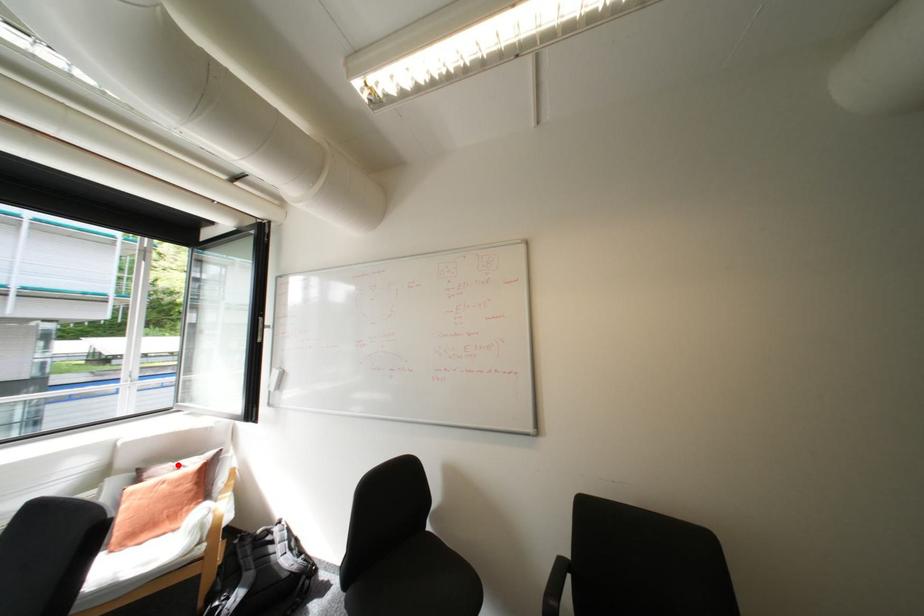
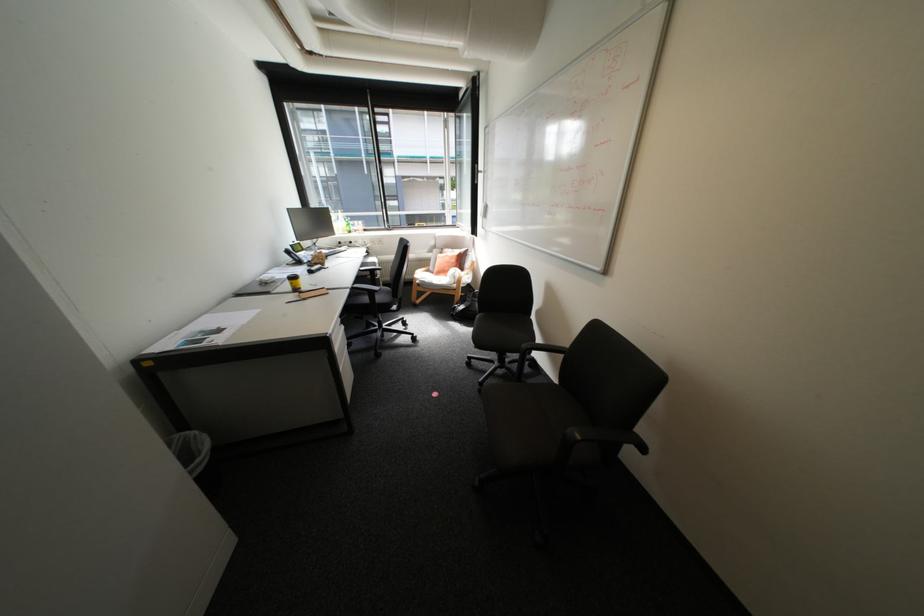
Question: I am providing you with two images of the same scene from different viewpoints. In image1, a red point is highlighted. Considering the same 3D point in image2, which of the following is correct?

Choices:
 (A) It is closer
 (B) It is farther

Answer: (A)